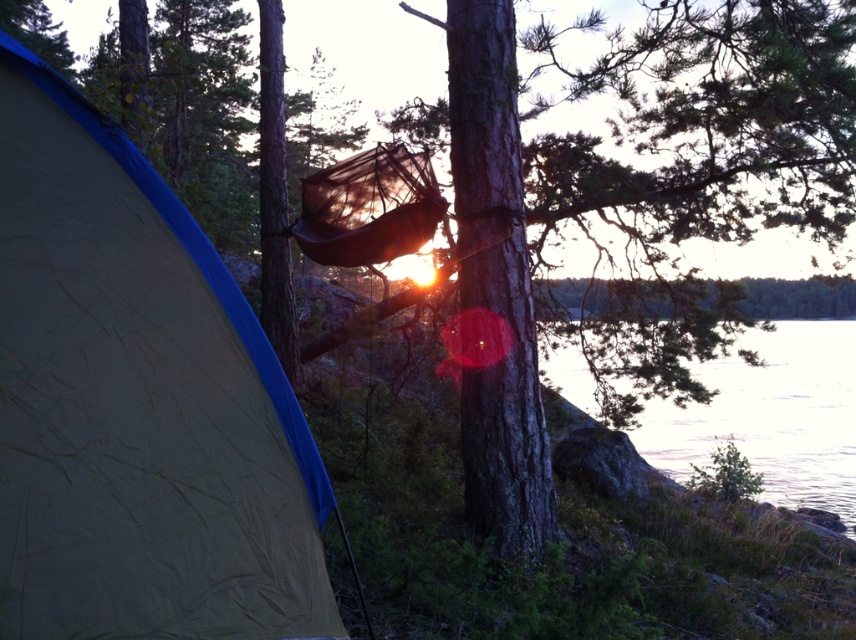
Question: Is beige fabric tent at left thinner than clear water at lower right?

Choices:
 (A) yes
 (B) no

Answer: (A)

Question: Among these objects, which one is nearest to the camera?

Choices:
 (A) beige fabric tent at left
 (B) clear water at lower right

Answer: (A)

Question: Can you confirm if beige fabric tent at left is bigger than clear water at lower right?

Choices:
 (A) yes
 (B) no

Answer: (B)

Question: Can you confirm if beige fabric tent at left is bigger than clear water at lower right?

Choices:
 (A) yes
 (B) no

Answer: (B)